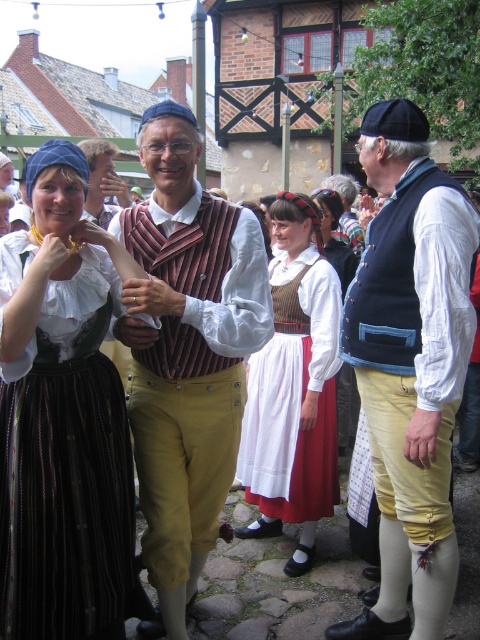
Question: Does matte black vest at center appear on the right side of white cotton dress at center?

Choices:
 (A) no
 (B) yes

Answer: (B)

Question: Which object is the farthest from the matte black vest at center?

Choices:
 (A) striped fabric vest at center
 (B) white cotton dress at center
 (C) matte black dirndl at left
 (D) matte brown vest at center

Answer: (D)

Question: Which point is farther to the camera?

Choices:
 (A) matte brown vest at center
 (B) matte black dirndl at left
 (C) matte black vest at center

Answer: (A)

Question: Does matte black dirndl at left have a lesser width compared to matte black vest at center?

Choices:
 (A) no
 (B) yes

Answer: (B)

Question: Which object is closer to the camera taking this photo?

Choices:
 (A) matte black vest at center
 (B) white cotton dress at center
 (C) matte brown vest at center

Answer: (A)

Question: Is matte black vest at center thinner than striped fabric vest at center?

Choices:
 (A) no
 (B) yes

Answer: (B)